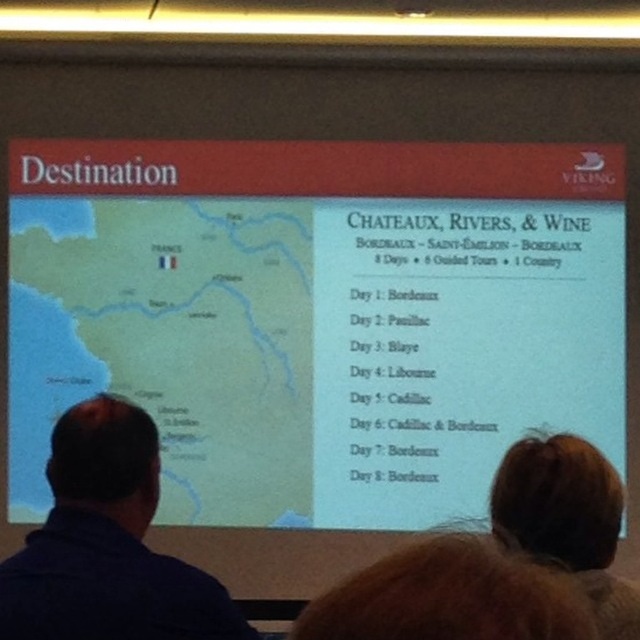
Does blue shirt at left appear under brown hair at upper right?

No, blue shirt at left is not below brown hair at upper right.

Based on the photo, who is higher up, blue shirt at left or brown hair at upper right?

blue shirt at left is above.

The image size is (640, 640). What do you see at coordinates (108, 545) in the screenshot? I see `blue shirt at left` at bounding box center [108, 545].

The width and height of the screenshot is (640, 640). I want to click on blue shirt at left, so [x=108, y=545].